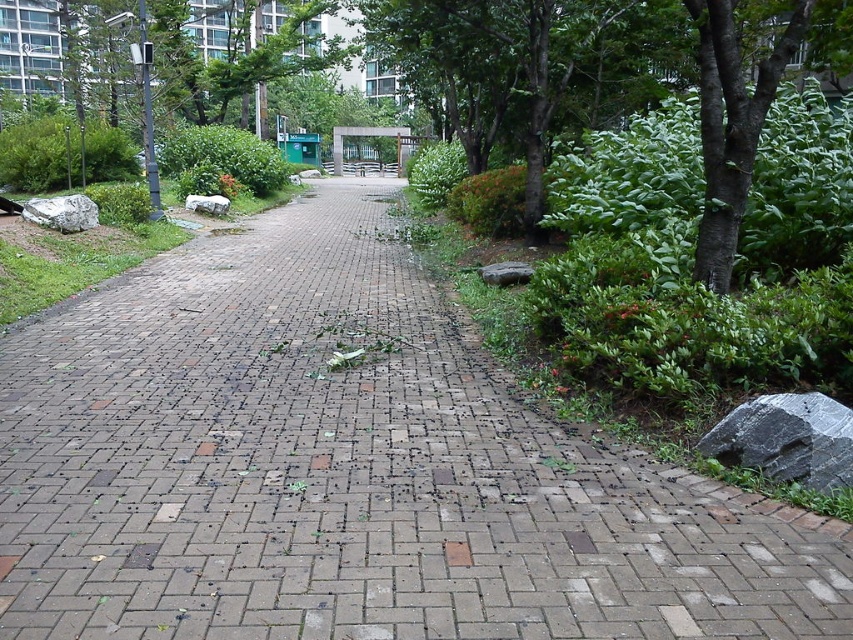
Between point (357, 125) and point (190, 196), which one is positioned behind?

Positioned behind is point (357, 125).

Identify the location of metallic silver bus stop at center. (358, 134).

Who is taller, brick at center or gray rough stone at center?

gray rough stone at center

Between brick at center and gray rough stone at center, which one is positioned higher?

Positioned higher is gray rough stone at center.

Locate an element on the screen. This screenshot has width=853, height=640. brick at center is located at coordinates (350, 468).

Between gray polished rock at lower right and metallic silver bus stop at center, which one has more height?

With more height is metallic silver bus stop at center.

Does gray polished rock at lower right have a greater height compared to metallic silver bus stop at center?

In fact, gray polished rock at lower right may be shorter than metallic silver bus stop at center.

This screenshot has width=853, height=640. Identify the location of gray polished rock at lower right. (786, 440).